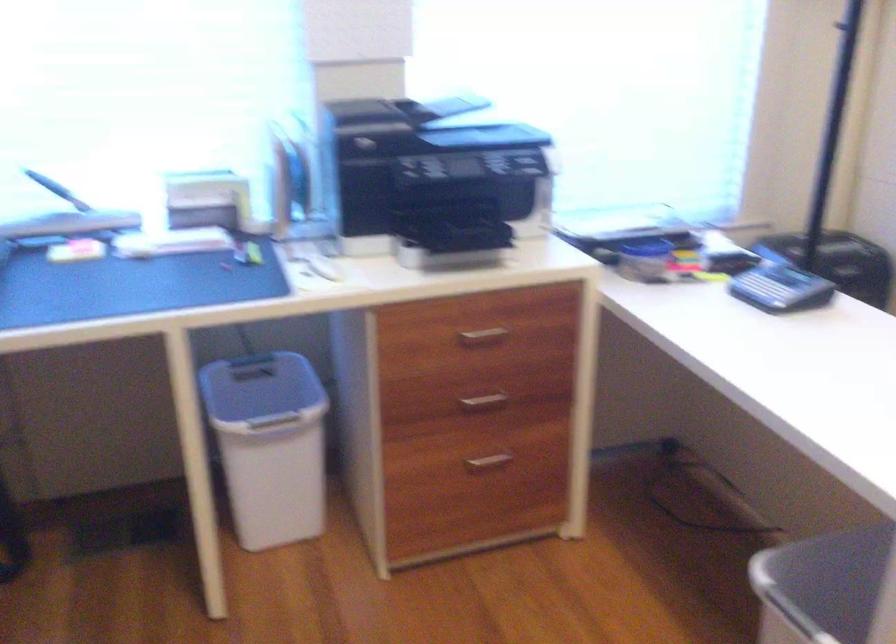
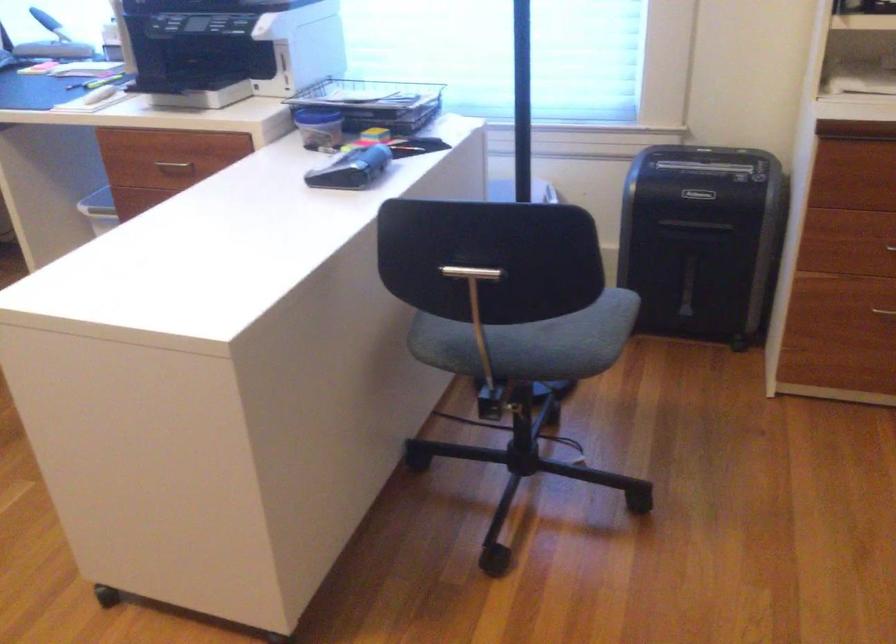
Locate, in the second image, the point that corresponds to the point at 661,234 in the first image.

(374, 102)